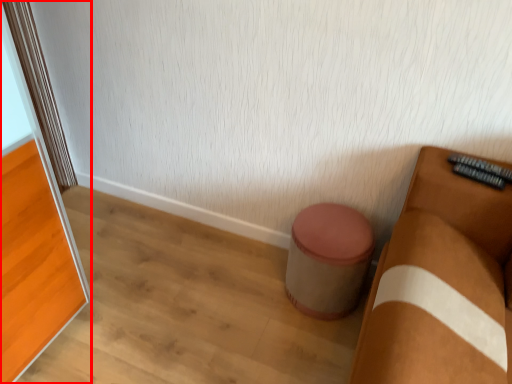
Question: Observing the image, what is the correct spatial positioning of screen door (annotated by the red box) in reference to stool?

Choices:
 (A) left
 (B) right

Answer: (A)